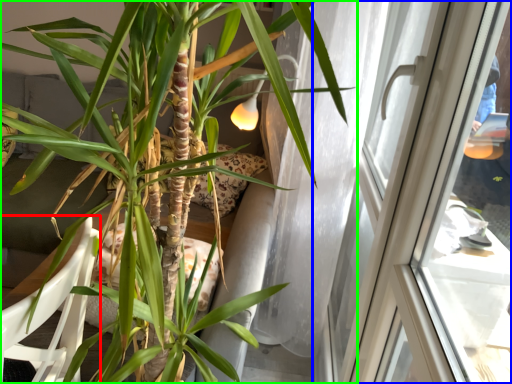
Question: Considering the real-world distances, which object is closest to armchair (highlighted by a red box)? window (highlighted by a blue box) or houseplant (highlighted by a green box).

Choices:
 (A) window
 (B) houseplant

Answer: (B)